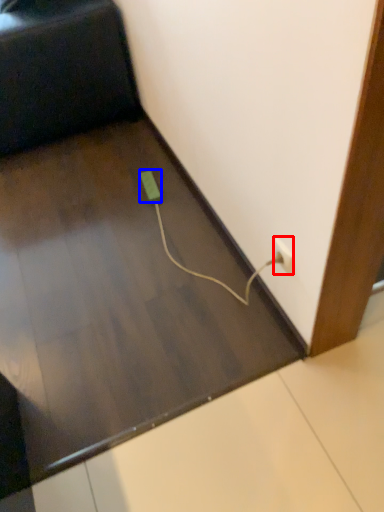
Question: Which point is further to the camera, power plugs and sockets (highlighted by a red box) or socket (highlighted by a blue box)?

Choices:
 (A) power plugs and sockets
 (B) socket

Answer: (B)